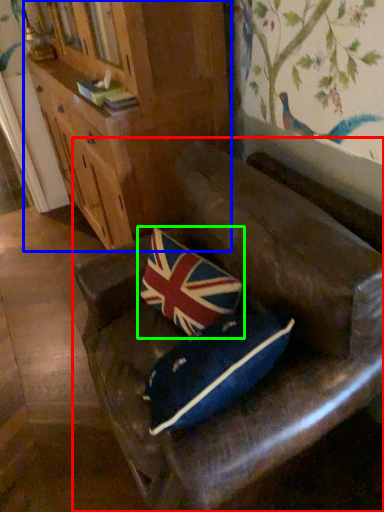
Question: Which is nearer to the furniture (highlighted by a red box)? cabinetry (highlighted by a blue box) or pillow (highlighted by a green box).

Choices:
 (A) cabinetry
 (B) pillow

Answer: (B)